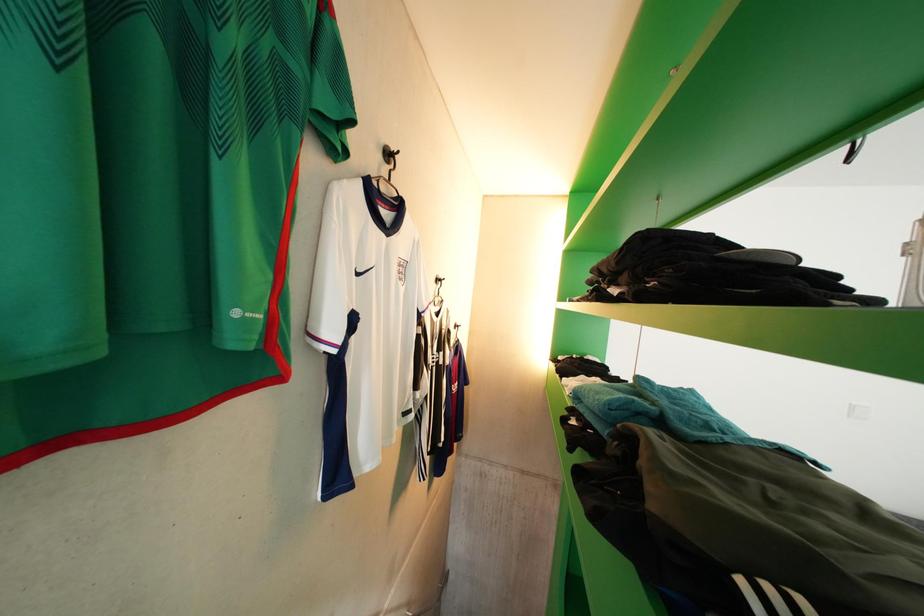
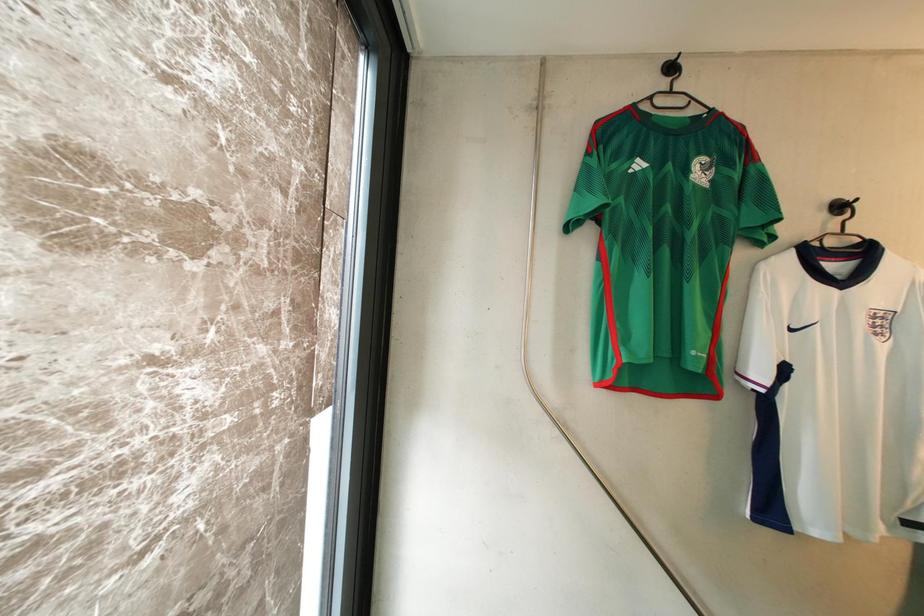
Question: The first image is from the beginning of the video and the second image is from the end. How did the camera likely rotate when shooting the video?

Choices:
 (A) Left
 (B) Right
 (C) Up
 (D) Down

Answer: (A)